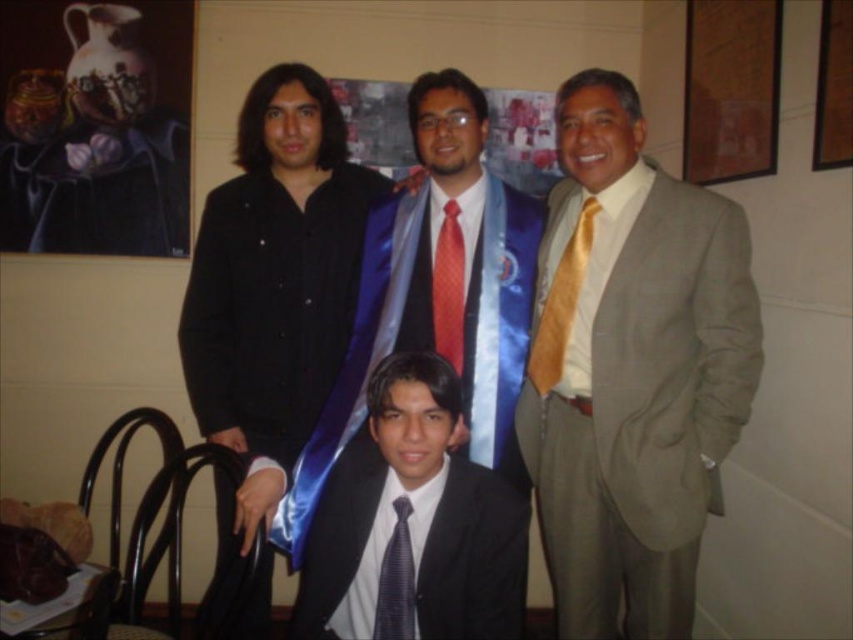
You are a photographer setting up for a group photo. You need to ensure there is at least 50 centimeters of space between the matte gray suit at right and the black satin suit at lower center for proper lighting. Based on the scene description, is the current spacing sufficient?

The distance between the matte gray suit at right and the black satin suit at lower center is 49.93 centimeters, which is just below the required 50 centimeters. Therefore, the current spacing is insufficient for the lighting setup.